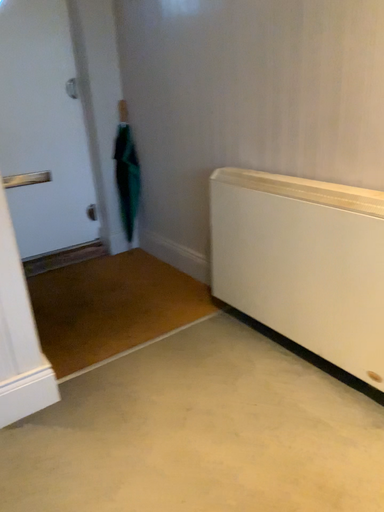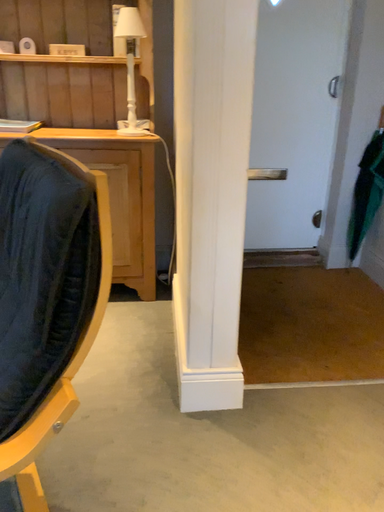
Question: How did the camera likely rotate when shooting the video?

Choices:
 (A) rotated right
 (B) rotated left

Answer: (B)